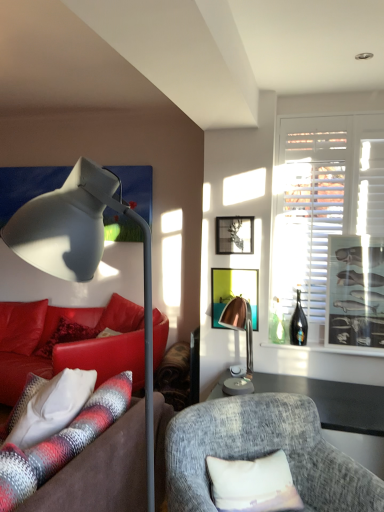
Question: Is white matte window at right wider or thinner than leather couch at left, the first studio couch from the back?

Choices:
 (A) thin
 (B) wide

Answer: (A)

Question: From a real-world perspective, is white matte window at right above or below leather couch at left, the first studio couch from the back?

Choices:
 (A) below
 (B) above

Answer: (B)

Question: Considering the real-world distances, which object is farthest from the textured gray armchair at center?

Choices:
 (A) black glass bottle at right
 (B) leather couch at left, the first studio couch from the back
 (C) metallic silver picture frame at upper center, marked as the first picture frame in a left-to-right arrangement
 (D) white matte window at right
 (E) metallic silver picture frame at right, which is the 3th picture frame in left-to-right order

Answer: (B)

Question: Which of these objects is positioned farthest from the metallic silver picture frame at upper center, marked as the first picture frame in a left-to-right arrangement?

Choices:
 (A) plush brown couch at left, positioned as the 1th studio couch in front-to-back order
 (B) white matte window at right
 (C) metallic silver picture frame at right, which is the first picture frame in right-to-left order
 (D) leather couch at left, the second studio couch viewed from the front
 (E) white fabric pillow at lower center, the 2th pillow when ordered from back to front

Answer: (D)